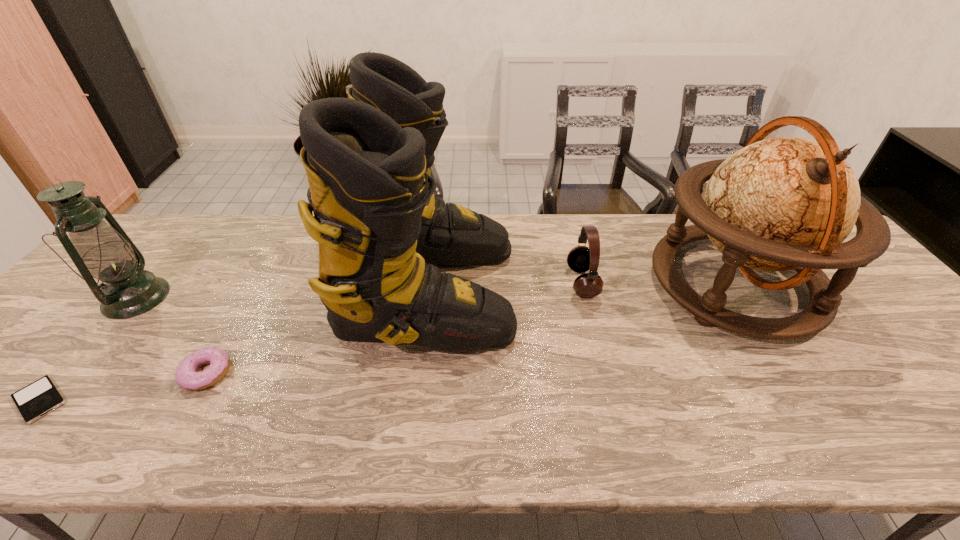
Where is `vacant space located 0.060m on the front of the fourth shortest object`? The width and height of the screenshot is (960, 540). vacant space located 0.060m on the front of the fourth shortest object is located at coordinates (101, 340).

Find the location of a particular element. The image size is (960, 540). vacant space located on the ear pads of the fifth object from left to right is located at coordinates (499, 282).

You are a GUI agent. You are given a task and a screenshot of the screen. Output one action in this format:
    pyautogui.click(x=<x>, y=<y>)
    Task: Click on the vacant space positioned 0.280m on the ear pads of the fifth object from left to right
    This screenshot has width=960, height=540.
    Given the screenshot: What is the action you would take?
    pyautogui.click(x=467, y=282)

Identify the location of vacant region located on the ear pads of the fifth object from left to right. The height and width of the screenshot is (540, 960). (499, 282).

This screenshot has width=960, height=540. Find the location of `vacant space located on the right of the second shortest object`. vacant space located on the right of the second shortest object is located at coordinates (359, 373).

At what (x,y) coordinates should I click in order to perform the action: click on ski boots at the far edge. Please return your answer as a coordinate pair (x, y). Looking at the image, I should click on (367, 157).

This screenshot has height=540, width=960. I want to click on globe located at the far edge, so click(x=786, y=203).

Locate an element on the screen. This screenshot has width=960, height=540. object positioned at the left edge is located at coordinates (104, 251).

What are the coordinates of `object positioned at the right edge` in the screenshot? It's located at (786, 203).

What are the coordinates of `object that is positioned at the far right corner` in the screenshot? It's located at (786, 203).